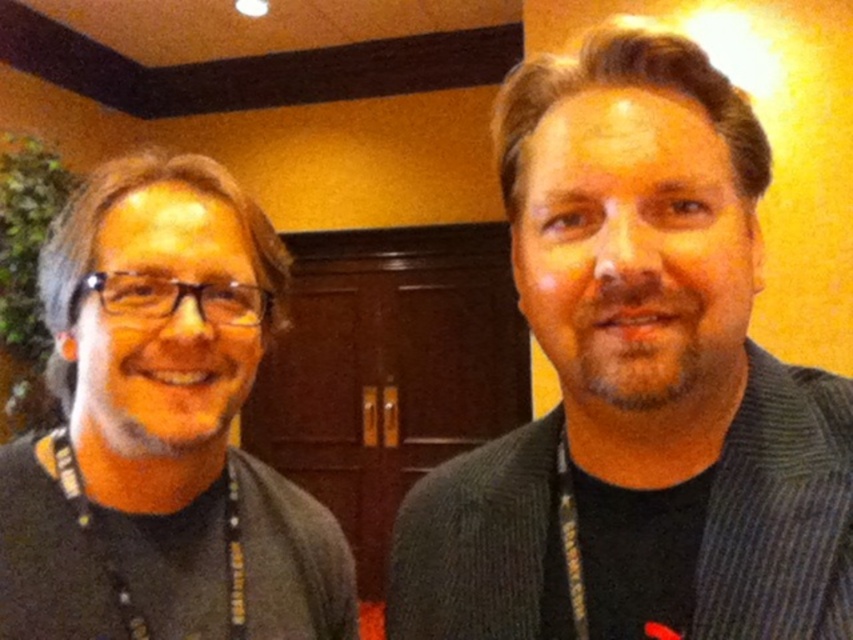
You are at a conference and need to identify two people based on their clothing. The first person has matte black glasses at left, and the second has a dark gray sweater at right. Which person is standing to the right of the other?

The dark gray sweater at right is to the right of the matte black glasses at left, so the person with the dark gray sweater at right is standing to the right of the person with the matte black glasses at left.

You are organizing a photo shoot and need to ensure that the dark gray sweater at right and the matte black glasses at left are visible in the frame. Based on their sizes, which object should you focus on first to ensure it doesn

The dark gray sweater at right has a larger size compared to the matte black glasses at left, so you should focus on the dark gray sweater at right first to ensure it is properly framed before adjusting for the smaller matte black glasses at left.